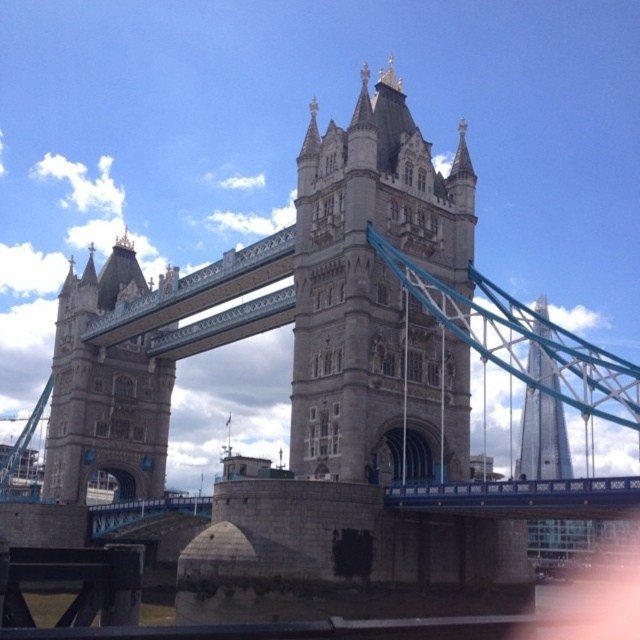
Which is in front, point (305, 257) or point (141, 282)?

Point (305, 257)

Is gray stone tower at center thinner than stone tower at center?

No.

What do you see at coordinates (378, 298) in the screenshot? I see `gray stone tower at center` at bounding box center [378, 298].

Where is `gray stone tower at center`? The image size is (640, 640). gray stone tower at center is located at coordinates (378, 298).